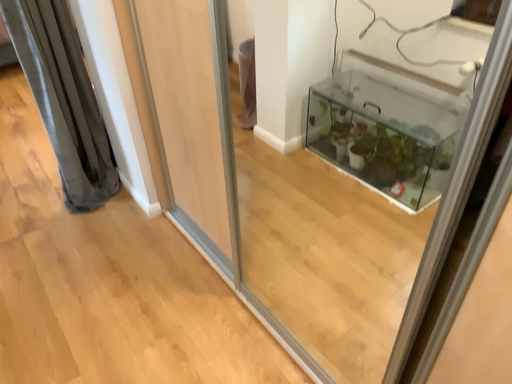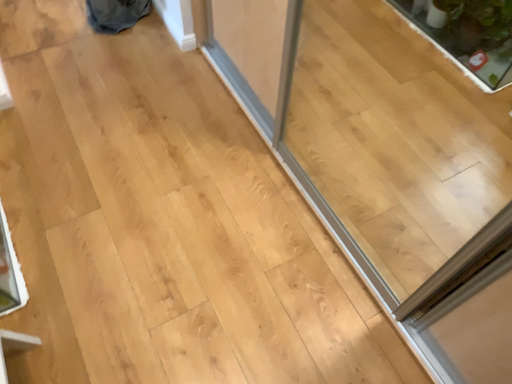
Question: Which way did the camera rotate in the video?

Choices:
 (A) rotated downward
 (B) rotated upward

Answer: (A)